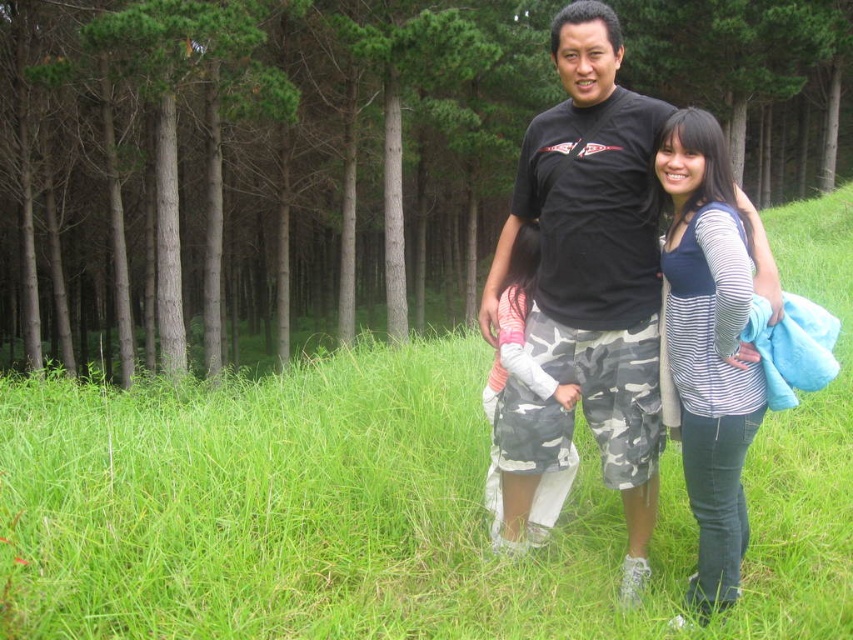
Describe the element at coordinates (251, 170) in the screenshot. The width and height of the screenshot is (853, 640). I see `green leafy tree at center` at that location.

Which is more to the left, green leafy tree at center or camouflage pants at center?

Positioned to the left is camouflage pants at center.

Which is behind, point (218, 332) or point (486, 404)?

The point (218, 332) is more distant.

The image size is (853, 640). I want to click on green leafy tree at center, so click(x=251, y=170).

Can you confirm if green grassy field at center is taller than black matte t-shirt at center?

Yes.

Is green grassy field at center bigger than black matte t-shirt at center?

Yes.

Does point (283, 564) come in front of point (773, 291)?

No, (283, 564) is further to viewer.

The width and height of the screenshot is (853, 640). Identify the location of green grassy field at center. (393, 500).

Can you confirm if green grassy field at center is bigger than blue striped shirt at center?

Correct, green grassy field at center is larger in size than blue striped shirt at center.

What do you see at coordinates (393, 500) in the screenshot? I see `green grassy field at center` at bounding box center [393, 500].

Where is `green grassy field at center`? green grassy field at center is located at coordinates (393, 500).